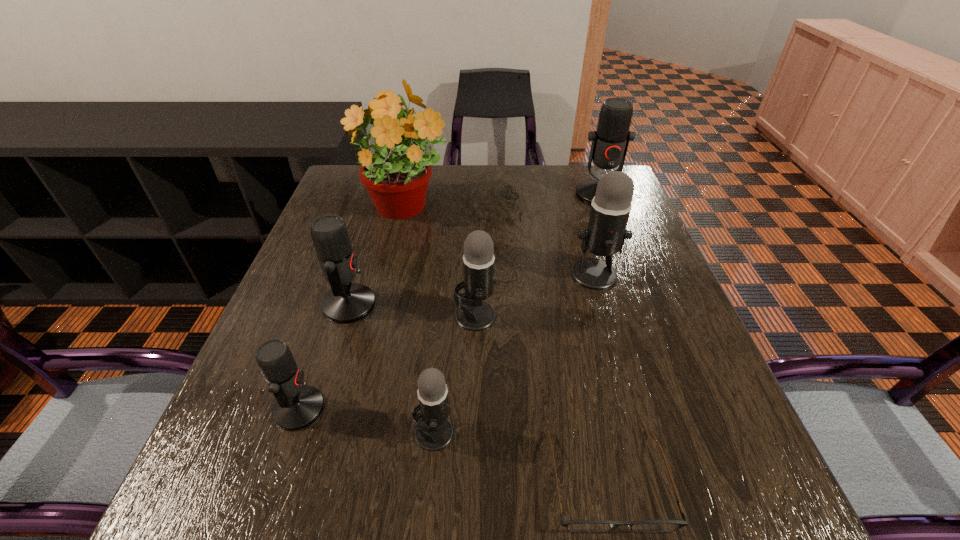
The height and width of the screenshot is (540, 960). Identify the location of spectacles. (577, 526).

The height and width of the screenshot is (540, 960). Find the location of `vacant space located on the right of the tallest object`. vacant space located on the right of the tallest object is located at coordinates (530, 211).

The width and height of the screenshot is (960, 540). What are the coordinates of `vacant space located on the side of the farthest microphone with the red ring` in the screenshot? It's located at (619, 245).

Image resolution: width=960 pixels, height=540 pixels. In order to click on vacant space located on the back of the farthest gray microphone in this screenshot , I will do `click(577, 213)`.

This screenshot has height=540, width=960. In order to click on vacant space located on the side of the second biggest red microphone with the red ring in this screenshot , I will do `click(421, 305)`.

This screenshot has height=540, width=960. I want to click on free space located on the right of the second farthest gray microphone, so click(623, 315).

Identify the location of free space located 0.320m on the side of the smallest red microphone with the red ring. Image resolution: width=960 pixels, height=540 pixels. (506, 409).

Where is `free space located 0.370m on the back of the smallest gray microphone`? This screenshot has width=960, height=540. free space located 0.370m on the back of the smallest gray microphone is located at coordinates (447, 273).

At what (x,y) coordinates should I click in order to perform the action: click on flowerpot that is at the far edge. Please return your answer as a coordinate pair (x, y). Image resolution: width=960 pixels, height=540 pixels. Looking at the image, I should click on (397, 182).

Identify the location of microphone that is at the far edge. Image resolution: width=960 pixels, height=540 pixels. (610, 141).